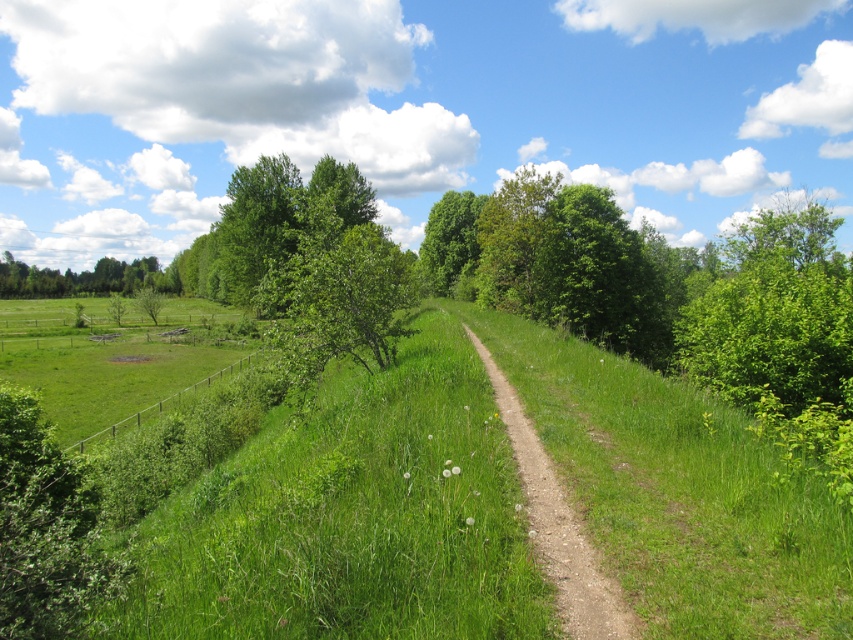
Is point (476, 344) positioned behind point (56, 273)?

No, (476, 344) is in front of (56, 273).

Which is behind, point (531, 451) or point (112, 257)?

The point (112, 257) is behind.

This screenshot has width=853, height=640. Identify the location of dirt path at center. (558, 528).

Does green leafy tree at left have a smaller size compared to green leafy tree at center?

Incorrect, green leafy tree at left is not smaller in size than green leafy tree at center.

Which is more to the right, green leafy tree at left or green leafy tree at center?

Positioned to the right is green leafy tree at center.

Find the location of a particular element. This screenshot has height=640, width=853. green leafy tree at left is located at coordinates (76, 278).

Which of these two, green leafy shrub at lower left or dirt path at center, stands taller?

Standing taller between the two is green leafy shrub at lower left.

Between green leafy shrub at lower left and dirt path at center, which one is positioned higher?

dirt path at center is above.

This screenshot has height=640, width=853. I want to click on green leafy shrub at lower left, so click(x=45, y=529).

Find the location of a particular element. green leafy shrub at lower left is located at coordinates (45, 529).